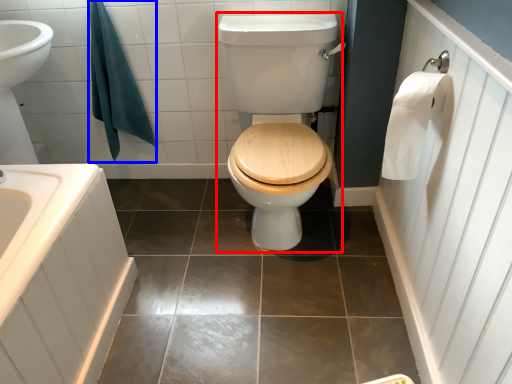
Question: Which point is closer to the camera, sit (highlighted by a red box) or bath towel (highlighted by a blue box)?

Choices:
 (A) sit
 (B) bath towel

Answer: (A)